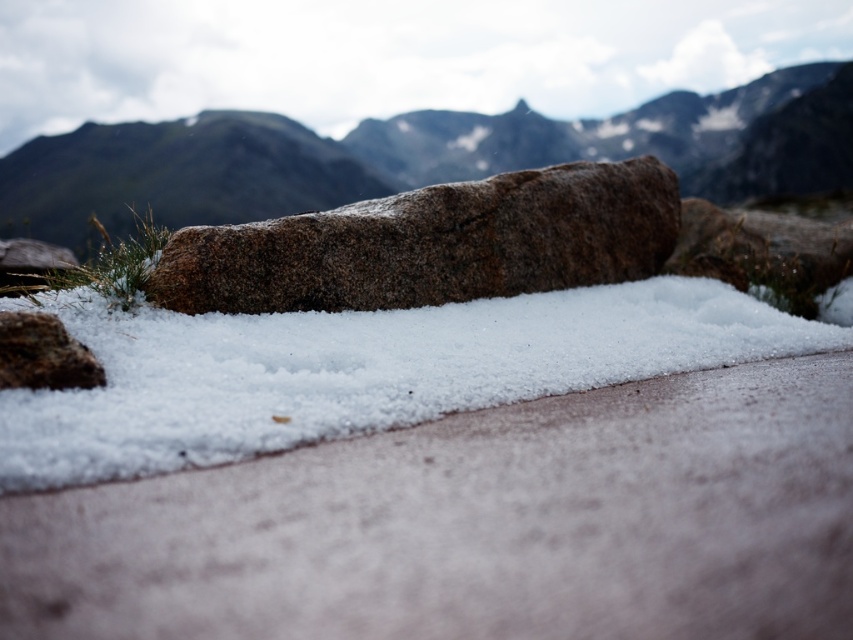
How far apart are white crystalline snow at center and granite boulder at center?

The distance of white crystalline snow at center from granite boulder at center is 19.70 inches.

Looking at this image, does white crystalline snow at center have a larger size compared to granite boulder at center?

Yes, white crystalline snow at center is bigger than granite boulder at center.

Which is in front, point (440, 385) or point (421, 244)?

Point (440, 385) is in front.

Locate an element on the screen. The height and width of the screenshot is (640, 853). white crystalline snow at center is located at coordinates click(x=358, y=371).

From the picture: Is white crystalline snow at center wider than granite rock at center?

No.

Does white crystalline snow at center have a lesser width compared to granite rock at center?

Indeed, white crystalline snow at center has a lesser width compared to granite rock at center.

Is point (677, 282) closer to viewer compared to point (659, 106)?

That is True.

You are a GUI agent. You are given a task and a screenshot of the screen. Output one action in this format:
    pyautogui.click(x=<x>, y=<y>)
    Task: Click on the white crystalline snow at center
    The width and height of the screenshot is (853, 640).
    Given the screenshot: What is the action you would take?
    pyautogui.click(x=358, y=371)

Is the position of granite rock at center less distant than that of granite boulder at center?

No, it is behind granite boulder at center.

Is granite rock at center smaller than granite boulder at center?

Incorrect, granite rock at center is not smaller in size than granite boulder at center.

Is point (271, 145) farther from camera compared to point (659, 176)?

Yes.

Identify the location of granite rock at center. The image size is (853, 640). (421, 156).